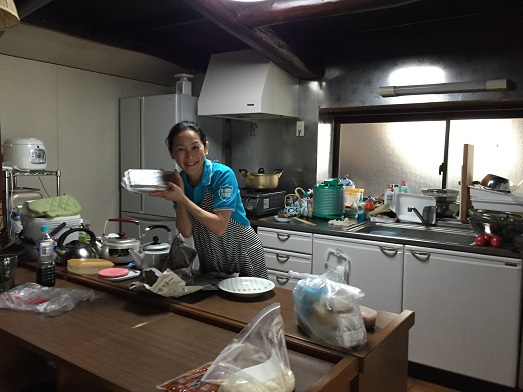
Find the location of a particular element. The height and width of the screenshot is (392, 523). faucet is located at coordinates (411, 210).